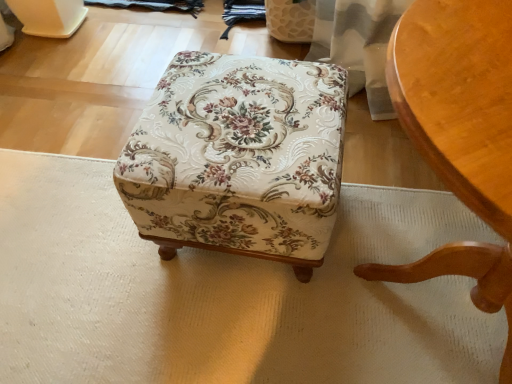
The image size is (512, 384). Describe the element at coordinates (239, 158) in the screenshot. I see `floral fabric ottoman at center` at that location.

Image resolution: width=512 pixels, height=384 pixels. Identify the location of floral fabric ottoman at center. click(x=239, y=158).

In order to face light brown wood chair at lower right, should I rotate leftwards or rightwards?

To face it directly, rotate right by 28.026 degrees.

Identify the location of light brown wood chair at lower right. (460, 135).

Describe the element at coordinates (460, 135) in the screenshot. I see `light brown wood chair at lower right` at that location.

At what (x,y) coordinates should I click in order to perform the action: click on floral fabric ottoman at center. Please return your answer as a coordinate pair (x, y). The height and width of the screenshot is (384, 512). Looking at the image, I should click on (239, 158).

In the image, is light brown wood chair at lower right on the left side or the right side of floral fabric ottoman at center?

From the image, it's evident that light brown wood chair at lower right is to the right of floral fabric ottoman at center.

Considering the positions of objects light brown wood chair at lower right and floral fabric ottoman at center in the image provided, who is behind, light brown wood chair at lower right or floral fabric ottoman at center?

floral fabric ottoman at center is more distant.

Is point (490, 156) closer or farther from the camera than point (250, 201)?

Point (490, 156).

From the image's perspective, is light brown wood chair at lower right over floral fabric ottoman at center?

No, from the image's perspective, light brown wood chair at lower right is not over floral fabric ottoman at center.

Based on the photo, from a real-world perspective, which is physically above, light brown wood chair at lower right or floral fabric ottoman at center?

From a 3D spatial view, light brown wood chair at lower right is above.

Which of these two, light brown wood chair at lower right or floral fabric ottoman at center, is thinner?

floral fabric ottoman at center.

Is light brown wood chair at lower right taller or shorter than floral fabric ottoman at center?

Answer: In the image, light brown wood chair at lower right appears to be taller than floral fabric ottoman at center.

Considering the relative sizes of light brown wood chair at lower right and floral fabric ottoman at center in the image provided, is light brown wood chair at lower right smaller than floral fabric ottoman at center?

No, light brown wood chair at lower right is not smaller than floral fabric ottoman at center.

Looking at this image, is light brown wood chair at lower right surrounding floral fabric ottoman at center?

No, light brown wood chair at lower right does not contain floral fabric ottoman at center.

Are light brown wood chair at lower right and floral fabric ottoman at center beside each other?

No, light brown wood chair at lower right is not beside floral fabric ottoman at center.

Is light brown wood chair at lower right oriented towards floral fabric ottoman at center?

Yes, light brown wood chair at lower right is oriented towards floral fabric ottoman at center.

Consider the image. What's the angular difference between light brown wood chair at lower right and floral fabric ottoman at center's facing directions?

The angular difference between light brown wood chair at lower right and floral fabric ottoman at center is 177 degrees.

Find the location of a particular element. The width and height of the screenshot is (512, 384). furniture below the light brown wood chair at lower right (from a real-world perspective) is located at coordinates (239, 158).

From the picture: Is floral fabric ottoman at center at the right side of light brown wood chair at lower right?

In fact, floral fabric ottoman at center is to the left of light brown wood chair at lower right.

Is the depth of floral fabric ottoman at center less than that of light brown wood chair at lower right?

No, the depth of floral fabric ottoman at center is greater than that of light brown wood chair at lower right.

Which is behind, point (177, 90) or point (454, 245)?

Positioned behind is point (177, 90).

From the image's perspective, is floral fabric ottoman at center on light brown wood chair at lower right?

Correct, floral fabric ottoman at center appears higher than light brown wood chair at lower right in the image.

From a real-world perspective, which object stands above the other?

In real-world perspective, light brown wood chair at lower right is above.

Which object is thinner, floral fabric ottoman at center or light brown wood chair at lower right?

With smaller width is floral fabric ottoman at center.

Considering the sizes of floral fabric ottoman at center and light brown wood chair at lower right in the image, is floral fabric ottoman at center taller or shorter than light brown wood chair at lower right?

In the image, floral fabric ottoman at center appears to be shorter than light brown wood chair at lower right.

Considering the sizes of objects floral fabric ottoman at center and light brown wood chair at lower right in the image provided, who is smaller, floral fabric ottoman at center or light brown wood chair at lower right?

floral fabric ottoman at center.

Is floral fabric ottoman at center situated inside light brown wood chair at lower right or outside?

floral fabric ottoman at center is outside light brown wood chair at lower right.

Is floral fabric ottoman at center directly adjacent to light brown wood chair at lower right?

They are not placed beside each other.

Could you tell me if floral fabric ottoman at center is turned towards light brown wood chair at lower right?

Yes, floral fabric ottoman at center is facing light brown wood chair at lower right.

Can you tell me how much floral fabric ottoman at center and light brown wood chair at lower right differ in facing direction?

The angle between the facing direction of floral fabric ottoman at center and the facing direction of light brown wood chair at lower right is 177 degrees.

Where is `furniture above the light brown wood chair at lower right (from the image's perspective)`? The image size is (512, 384). furniture above the light brown wood chair at lower right (from the image's perspective) is located at coordinates (239, 158).

Find the location of a particular element. The width and height of the screenshot is (512, 384). chair lying on the right of floral fabric ottoman at center is located at coordinates (460, 135).

I want to click on furniture above the light brown wood chair at lower right (from the image's perspective), so click(239, 158).